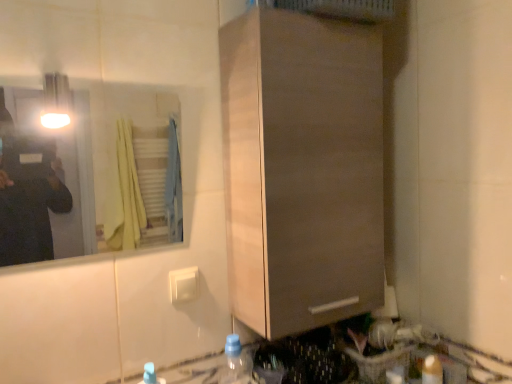
Question: Is clear glass mirror at upper left outside matte wood cabinet at center?

Choices:
 (A) no
 (B) yes

Answer: (B)

Question: From a real-world perspective, is clear glass mirror at upper left positioned under matte wood cabinet at center based on gravity?

Choices:
 (A) no
 (B) yes

Answer: (A)

Question: Could you tell me if clear glass mirror at upper left is turned towards matte wood cabinet at center?

Choices:
 (A) no
 (B) yes

Answer: (A)

Question: Is clear glass mirror at upper left looking in the opposite direction of matte wood cabinet at center?

Choices:
 (A) yes
 (B) no

Answer: (B)

Question: Is clear glass mirror at upper left positioned before matte wood cabinet at center?

Choices:
 (A) yes
 (B) no

Answer: (A)

Question: Are clear glass mirror at upper left and matte wood cabinet at center located far from each other?

Choices:
 (A) no
 (B) yes

Answer: (A)

Question: Is blue translucent bottle at lower center, marked as the 1th bottle in a left-to-right arrangement, located outside translucent plastic bottle at lower center, the 2th bottle from the right?

Choices:
 (A) no
 (B) yes

Answer: (B)

Question: Is blue translucent bottle at lower center, marked as the 1th bottle in a left-to-right arrangement, positioned with its back to translucent plastic bottle at lower center, the 2th bottle from the right?

Choices:
 (A) yes
 (B) no

Answer: (B)

Question: From a real-world perspective, is blue translucent bottle at lower center, which is counted as the 3th bottle, starting from the right, physically above translucent plastic bottle at lower center, placed as the second bottle when sorted from left to right?

Choices:
 (A) no
 (B) yes

Answer: (B)

Question: From a real-world perspective, is blue translucent bottle at lower center, which is counted as the 3th bottle, starting from the right, below translucent plastic bottle at lower center, placed as the second bottle when sorted from left to right?

Choices:
 (A) yes
 (B) no

Answer: (B)

Question: Does blue translucent bottle at lower center, which is counted as the 3th bottle, starting from the right, lie behind translucent plastic bottle at lower center, placed as the second bottle when sorted from left to right?

Choices:
 (A) yes
 (B) no

Answer: (B)

Question: Considering the relative sizes of blue translucent bottle at lower center, which is counted as the 3th bottle, starting from the right, and translucent plastic bottle at lower center, the 2th bottle from the right, in the image provided, is blue translucent bottle at lower center, which is counted as the 3th bottle, starting from the right, thinner than translucent plastic bottle at lower center, the 2th bottle from the right,?

Choices:
 (A) yes
 (B) no

Answer: (A)

Question: Would you say translucent plastic bottle at lower right, which is the 3th bottle from left to right, is outside blue translucent bottle at lower center, marked as the 1th bottle in a left-to-right arrangement?

Choices:
 (A) no
 (B) yes

Answer: (B)